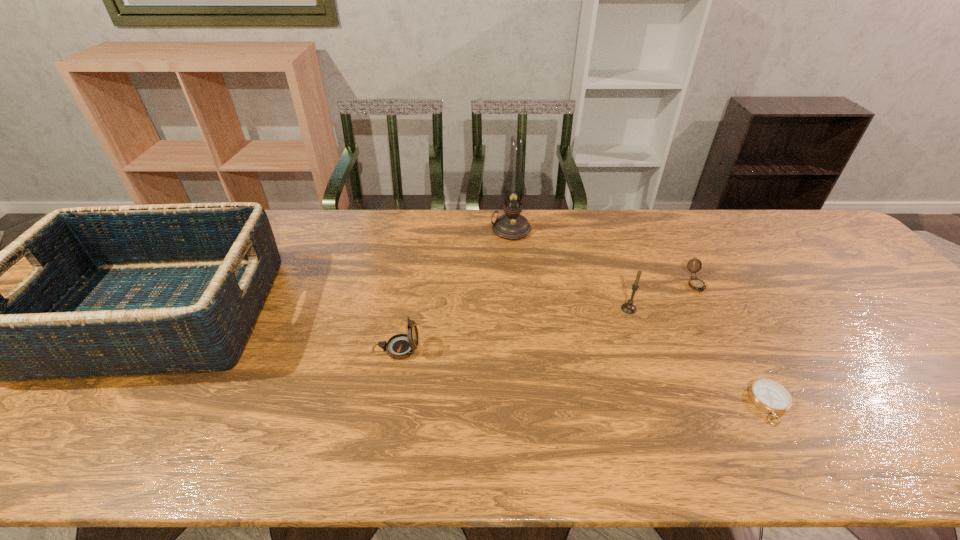
Find the location of `vacant space that is in between the shortest compass and the second tallest compass`. vacant space that is in between the shortest compass and the second tallest compass is located at coordinates (733, 343).

The height and width of the screenshot is (540, 960). In order to click on vacant area that lies between the leftmost compass and the fourth shortest object in this screenshot , I will do `click(513, 329)`.

The image size is (960, 540). In order to click on free area in between the fourth shortest object and the tallest object in this screenshot , I will do `click(570, 269)`.

The width and height of the screenshot is (960, 540). Find the location of `free space between the second farthest compass and the shortest compass`. free space between the second farthest compass and the shortest compass is located at coordinates (584, 376).

At what (x,y) coordinates should I click in order to perform the action: click on vacant space in between the fifth tallest object and the farthest object. Please return your answer as a coordinate pair (x, y). The image size is (960, 540). Looking at the image, I should click on point(603,257).

Where is `vacant area that lies between the candle and the shortest object`? This screenshot has height=540, width=960. vacant area that lies between the candle and the shortest object is located at coordinates [700, 356].

Where is `vacant area that lies between the oil lamp and the candle`? This screenshot has width=960, height=540. vacant area that lies between the oil lamp and the candle is located at coordinates (570, 269).

I want to click on object identified as the third closest to the third object from left to right, so click(695, 283).

Locate which object ranks fifth in proximity to the fifth tallest object. Please provide its 2D coordinates. Your answer should be formatted as a tuple, i.e. [(x, y)], where the tuple contains the x and y coordinates of a point satisfying the conditions above.

[(165, 289)]

Locate an element on the screen. This screenshot has width=960, height=540. compass identified as the third closest to the oil lamp is located at coordinates (770, 396).